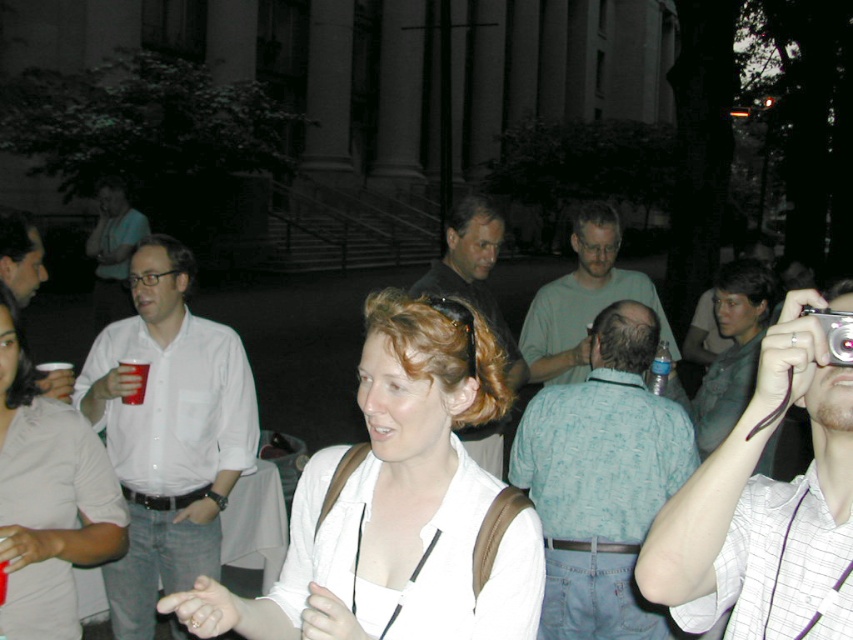
Question: Is light blue printed shirt at center to the left of light blue textured shirt at upper right from the viewer's perspective?

Choices:
 (A) no
 (B) yes

Answer: (B)

Question: Observing the image, what is the correct spatial positioning of light blue printed shirt at center in reference to light beige shirt at center?

Choices:
 (A) above
 (B) below

Answer: (B)

Question: Which point is closer to the camera?

Choices:
 (A) light beige shirt at center
 (B) white shirt at left

Answer: (A)

Question: Which point is farther to the camera?

Choices:
 (A) light blue textured shirt at upper right
 (B) white shirt at left

Answer: (B)

Question: Among these objects, which one is nearest to the camera?

Choices:
 (A) white matte shirt at center
 (B) white checkered shirt at upper right
 (C) silver metallic camera at upper right
 (D) dark brown hair at center

Answer: (B)

Question: Does light blue textured shirt at upper right come in front of white shirt at center?

Choices:
 (A) yes
 (B) no

Answer: (B)